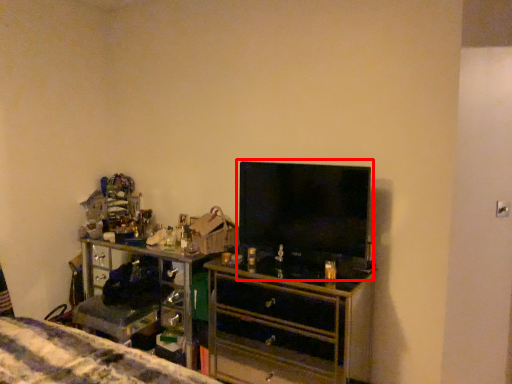
Question: From the image's perspective, where is tv show (annotated by the red box) located in relation to chest of drawers in the image?

Choices:
 (A) above
 (B) below

Answer: (A)